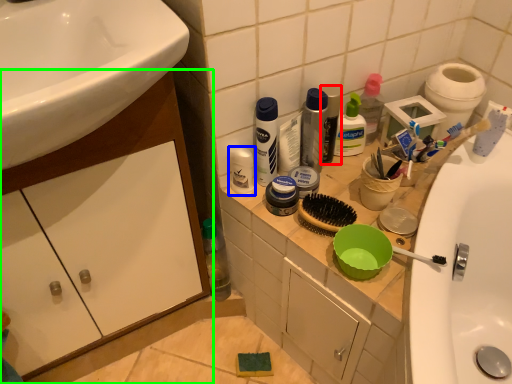
Question: Which object is positioned farthest from mouthwash (highlighted by a red box)? Select from toiletry (highlighted by a blue box) and bathroom cabinet (highlighted by a green box).

Choices:
 (A) toiletry
 (B) bathroom cabinet

Answer: (B)